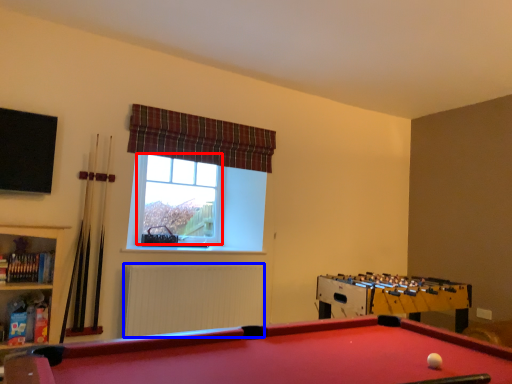
Question: Which object appears farthest to the camera in this image, bay window (highlighted by a red box) or radiator (highlighted by a blue box)?

Choices:
 (A) bay window
 (B) radiator

Answer: (A)